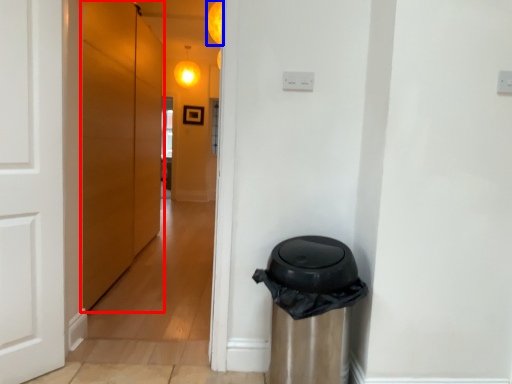
Question: Which object appears farthest to the camera in this image, door (highlighted by a red box) or light (highlighted by a blue box)?

Choices:
 (A) door
 (B) light

Answer: (B)